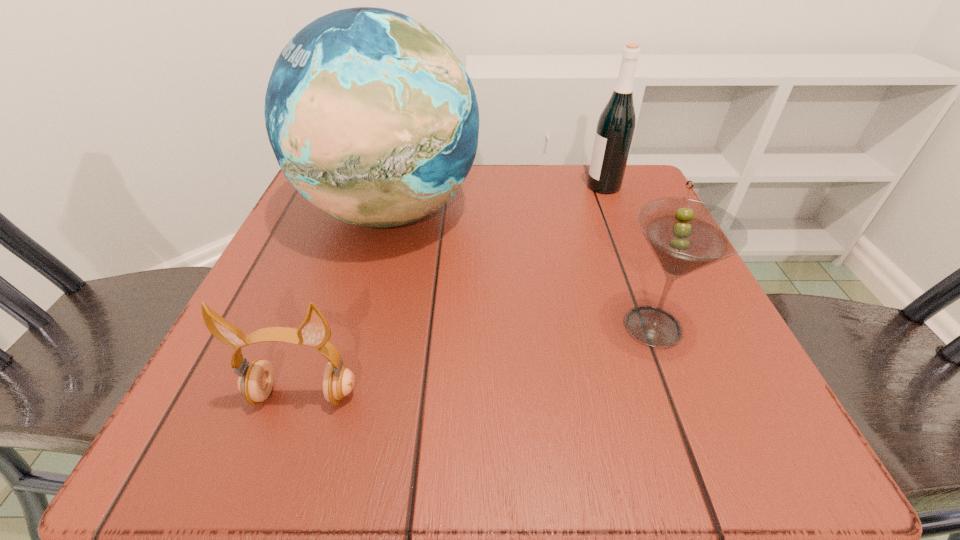
The width and height of the screenshot is (960, 540). I want to click on globe, so click(373, 119).

The width and height of the screenshot is (960, 540). I want to click on the second tallest object, so click(616, 125).

Locate an element on the screen. The image size is (960, 540). the second nearest object is located at coordinates point(685,235).

Locate an element on the screen. The width and height of the screenshot is (960, 540). the second shortest object is located at coordinates (685, 235).

Locate an element on the screen. This screenshot has width=960, height=540. earphone is located at coordinates (255, 382).

You are a GUI agent. You are given a task and a screenshot of the screen. Output one action in this format:
    pyautogui.click(x=<x>, y=<y>)
    Task: Click on the nearest object
    Image resolution: width=960 pixels, height=540 pixels.
    Given the screenshot: What is the action you would take?
    pyautogui.click(x=255, y=382)

This screenshot has height=540, width=960. Identify the location of free location located on the front of the globe. (367, 302).

In order to click on vacant region located on the label of the third shortest object in this screenshot , I will do [x=514, y=186].

Locate an element on the screen. free space located on the label of the third shortest object is located at coordinates (564, 186).

Identify the location of vacant space located 0.160m on the label of the third shortest object. (514, 186).